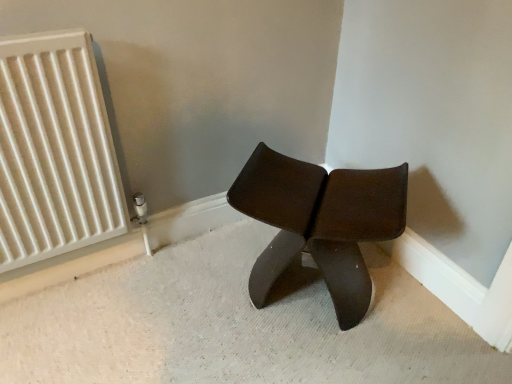
The width and height of the screenshot is (512, 384). I want to click on free location in front of matte brown stool at center, so (315, 354).